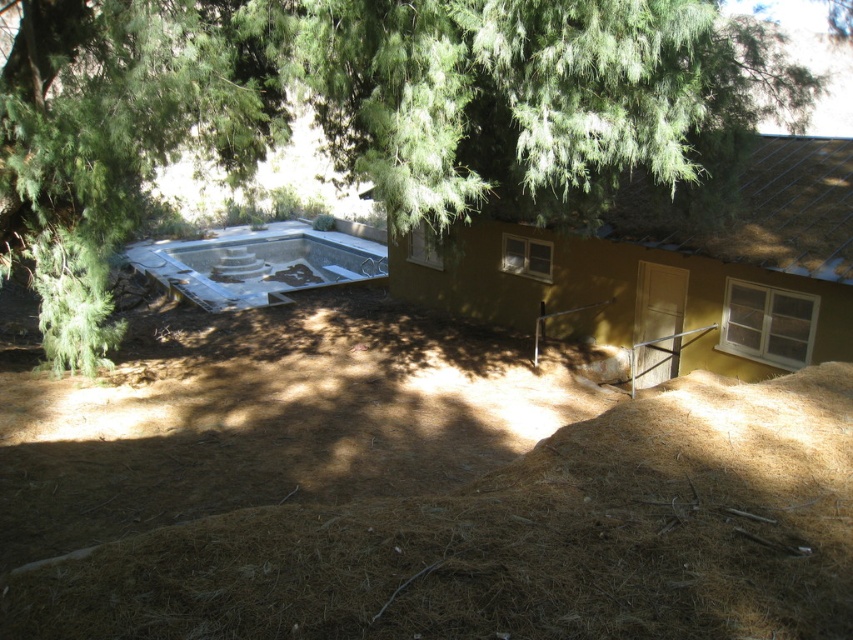
Question: Which point appears closest to the camera in this image?

Choices:
 (A) (801, 371)
 (B) (102, 289)

Answer: (A)

Question: Can you confirm if green leafy tree at upper center is positioned above brown dry hay at lower center?

Choices:
 (A) yes
 (B) no

Answer: (A)

Question: Is green leafy tree at upper center positioned in front of brown dry hay at lower center?

Choices:
 (A) no
 (B) yes

Answer: (A)

Question: Is green leafy tree at upper center closer to the viewer compared to brown dry hay at lower center?

Choices:
 (A) yes
 (B) no

Answer: (B)